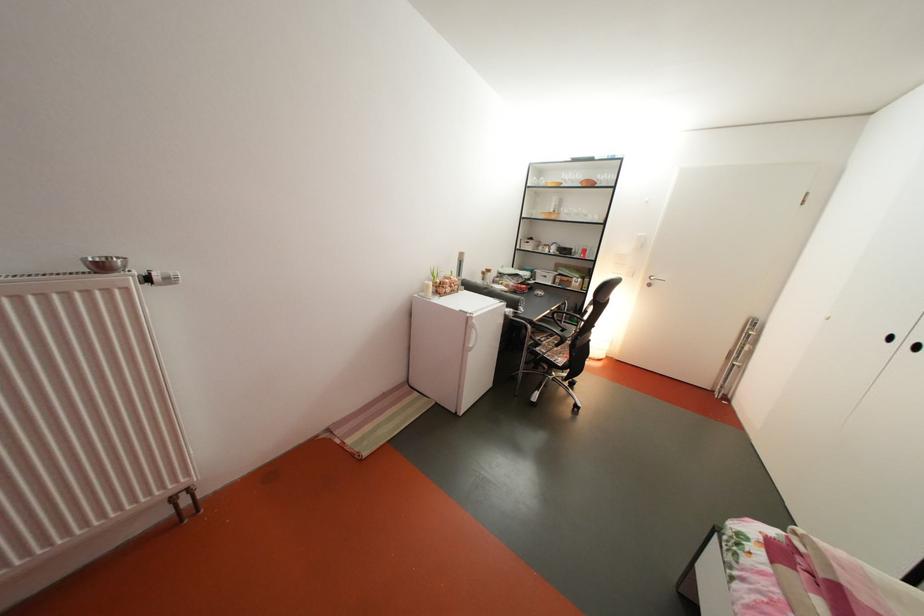
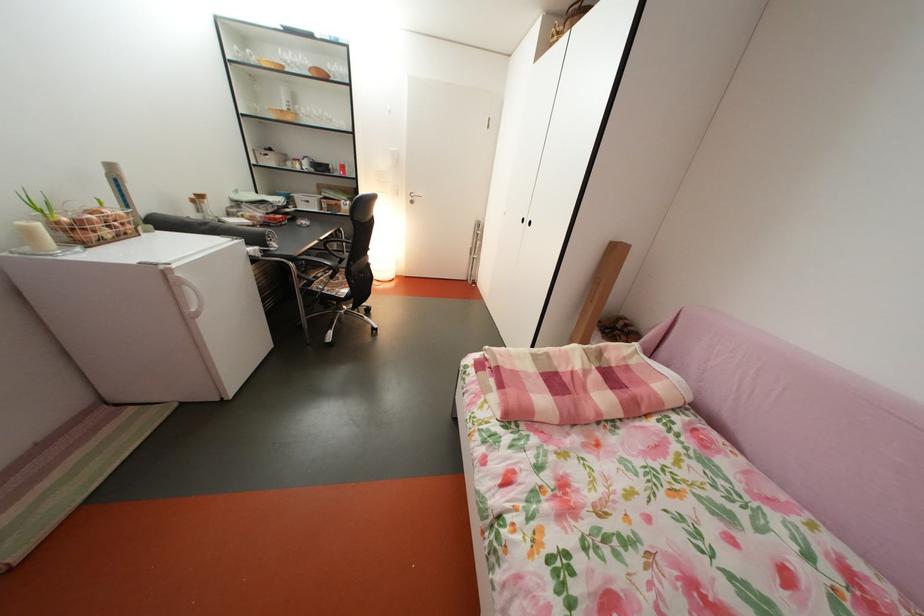
Where in the second image is the point corresponding to the point at 459,296 from the first image?

(118, 238)